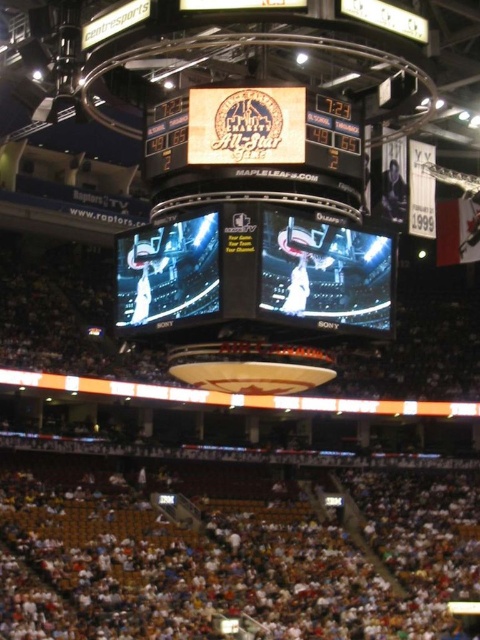
Does point (186, 486) come farther from viewer compared to point (217, 138)?

Yes, point (186, 486) is behind point (217, 138).

Can you confirm if white fabric crowd at lower center is bigger than wooden sign at center?

Yes.

Who is more distant from viewer, (300, 620) or (320, 100)?

The point (300, 620) is more distant.

Identify the location of white fabric crowd at lower center. Image resolution: width=480 pixels, height=640 pixels. (232, 552).

Measure the distance between white fabric crowd at lower center and camera.

white fabric crowd at lower center and camera are 208.29 feet apart.

Which is more to the right, white fabric crowd at lower center or black glossy scoreboard at center?

Positioned to the right is white fabric crowd at lower center.

Who is more forward, (x=463, y=563) or (x=225, y=256)?

Point (x=225, y=256)

This screenshot has height=640, width=480. Identify the location of white fabric crowd at lower center. (232, 552).

Is black glossy scoreboard at center behind wooden sign at center?

No, it is in front of wooden sign at center.

Describe the element at coordinates (252, 272) in the screenshot. I see `black glossy scoreboard at center` at that location.

You are a GUI agent. You are given a task and a screenshot of the screen. Output one action in this format:
    pyautogui.click(x=<x>, y=<y>)
    Task: Click on the black glossy scoreboard at center
    
    Given the screenshot: What is the action you would take?
    pyautogui.click(x=252, y=272)